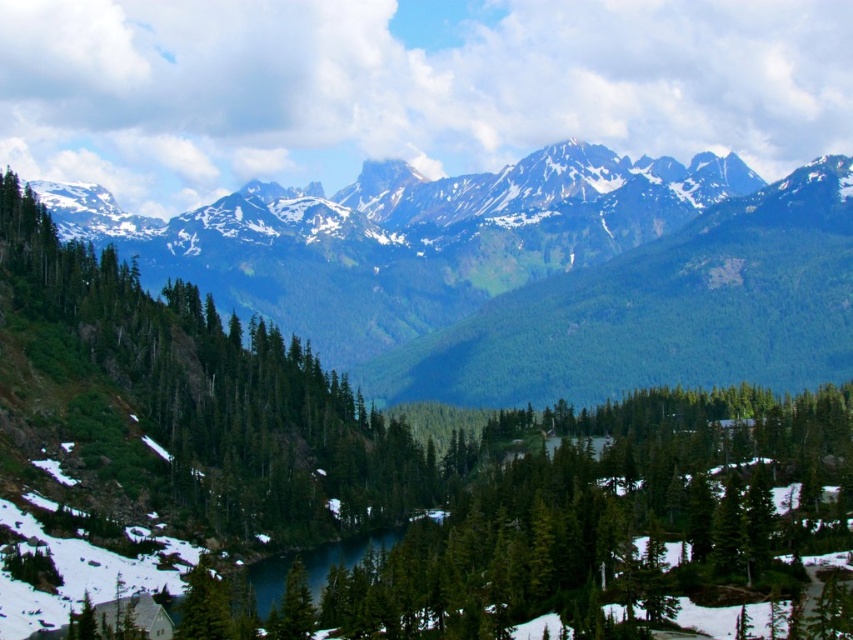
Question: Which of the following is the closest to the observer?

Choices:
 (A) (408, 340)
 (B) (138, 460)

Answer: (B)

Question: Which point appears closest to the camera in this image?

Choices:
 (A) (166, 380)
 (B) (433, 193)

Answer: (A)

Question: Can you confirm if green textured mountains at center is positioned below green matte tree at center?

Choices:
 (A) yes
 (B) no

Answer: (B)

Question: Does green textured mountains at center appear over green matte tree at center?

Choices:
 (A) no
 (B) yes

Answer: (B)

Question: Does green textured mountains at center have a lesser width compared to green matte tree at center?

Choices:
 (A) no
 (B) yes

Answer: (A)